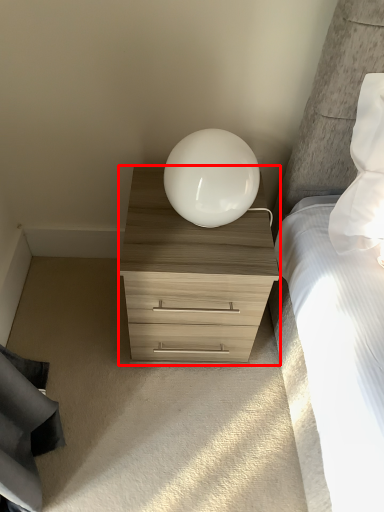
Question: From the image's perspective, where is chest of drawers (annotated by the red box) located in relation to table lamp in the image?

Choices:
 (A) above
 (B) below

Answer: (B)